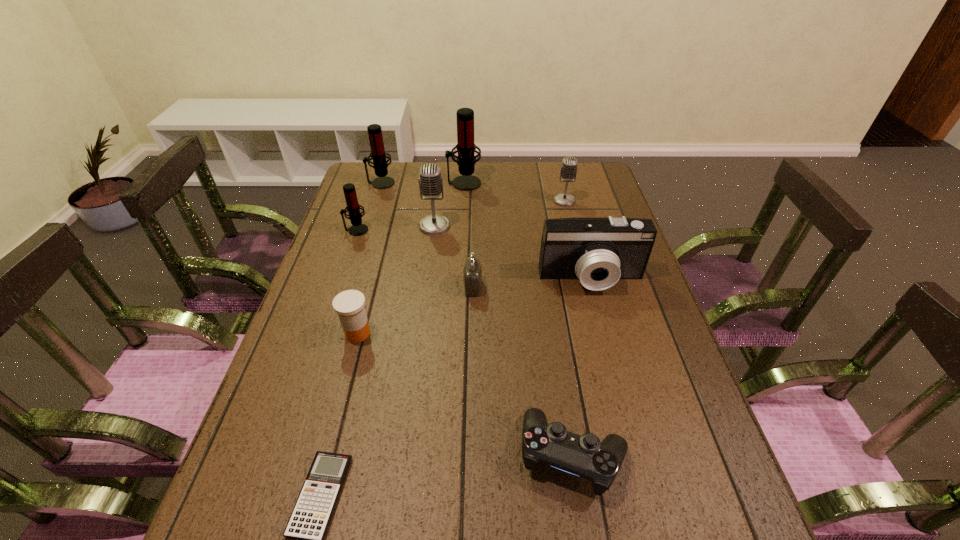
Where is `microphone that is the second closest to the second smallest red microphone`? microphone that is the second closest to the second smallest red microphone is located at coordinates point(430,181).

The image size is (960, 540). I want to click on the third closest microphone to the eighth farthest object, so click(378, 154).

The image size is (960, 540). Identify the location of the third closest red microphone relative to the shortest object. (378, 154).

Point out which red microphone is positioned as the third nearest to the black camcorder. Please provide its 2D coordinates. Your answer should be formatted as a tuple, i.e. [(x, y)], where the tuple contains the x and y coordinates of a point satisfying the conditions above.

[(378, 154)]

This screenshot has width=960, height=540. Find the location of `vacant space that satisfies the following two spatial constraints: 1. on the lens of the black camcorder; 2. at the front of the padlock near the keyhole`. vacant space that satisfies the following two spatial constraints: 1. on the lens of the black camcorder; 2. at the front of the padlock near the keyhole is located at coordinates (593, 287).

At what (x,y) coordinates should I click in order to perform the action: click on vacant space that satisfies the following two spatial constraints: 1. at the front of the padlock near the keyhole; 2. on the right side of the second shortest object. Please return your answer as a coordinate pair (x, y). The height and width of the screenshot is (540, 960). Looking at the image, I should click on (469, 455).

Where is `free point that satisfies the following two spatial constraints: 1. on the front side of the biggest red microphone; 2. on the right side of the second biggest red microphone`? Image resolution: width=960 pixels, height=540 pixels. free point that satisfies the following two spatial constraints: 1. on the front side of the biggest red microphone; 2. on the right side of the second biggest red microphone is located at coordinates (381, 183).